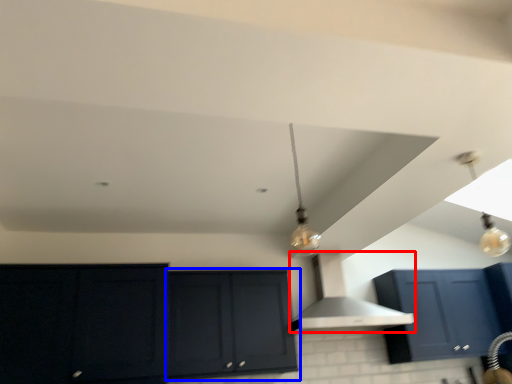
Question: Which object appears closest to the camera in this image, vent (highlighted by a red box) or cabinetry (highlighted by a blue box)?

Choices:
 (A) vent
 (B) cabinetry

Answer: (B)